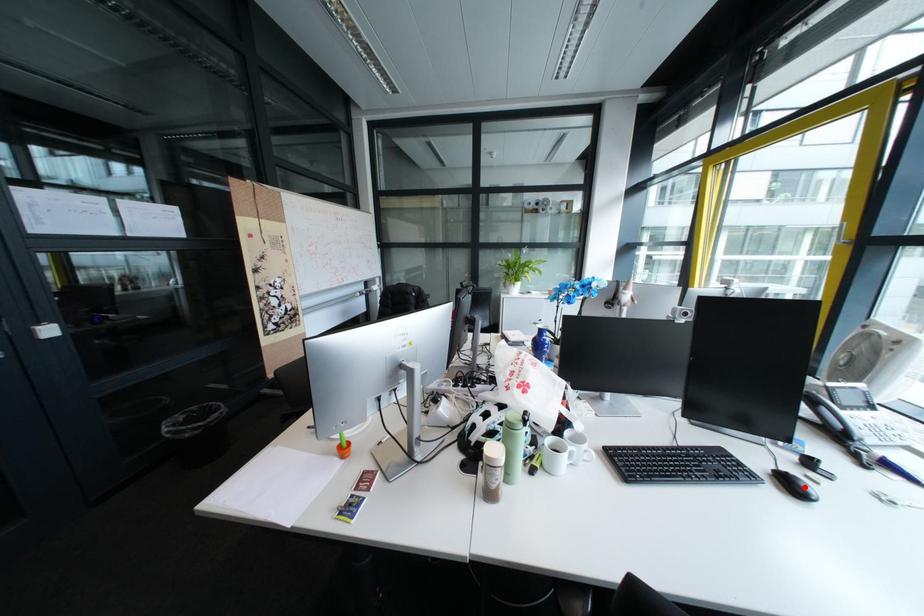
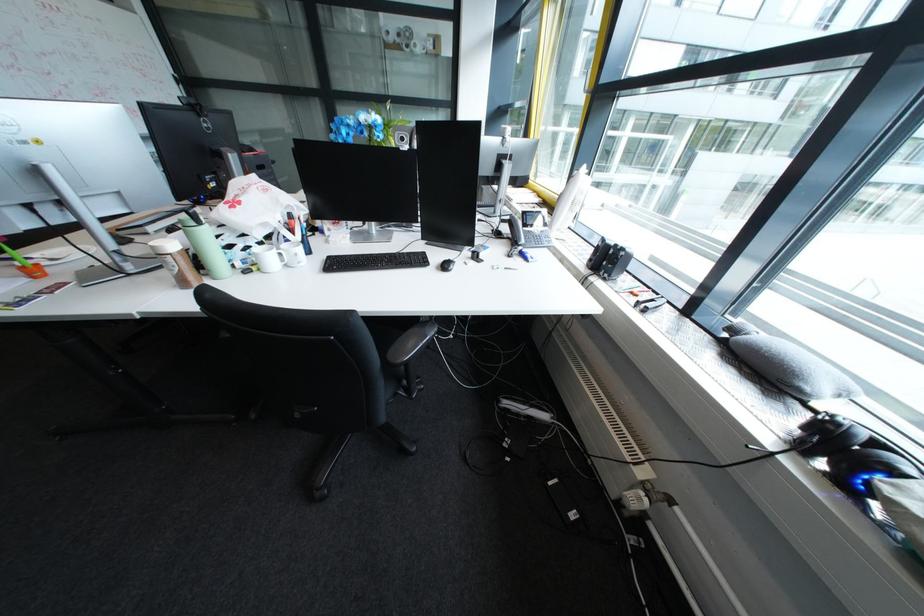
Question: I am providing you with two images of the same scene from different viewpoints. A red point is marked on the first image. Can you still see the location of the red point in image 2?

Choices:
 (A) Yes
 (B) No

Answer: (B)